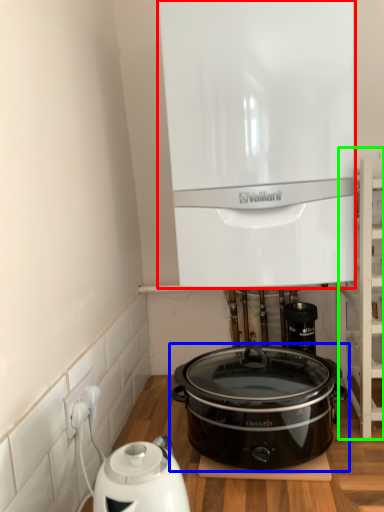
Question: Considering the real-world distances, which object is closest to home appliance (highlighted by a red box)? slow cooker (highlighted by a blue box) or shelf (highlighted by a green box).

Choices:
 (A) slow cooker
 (B) shelf

Answer: (B)